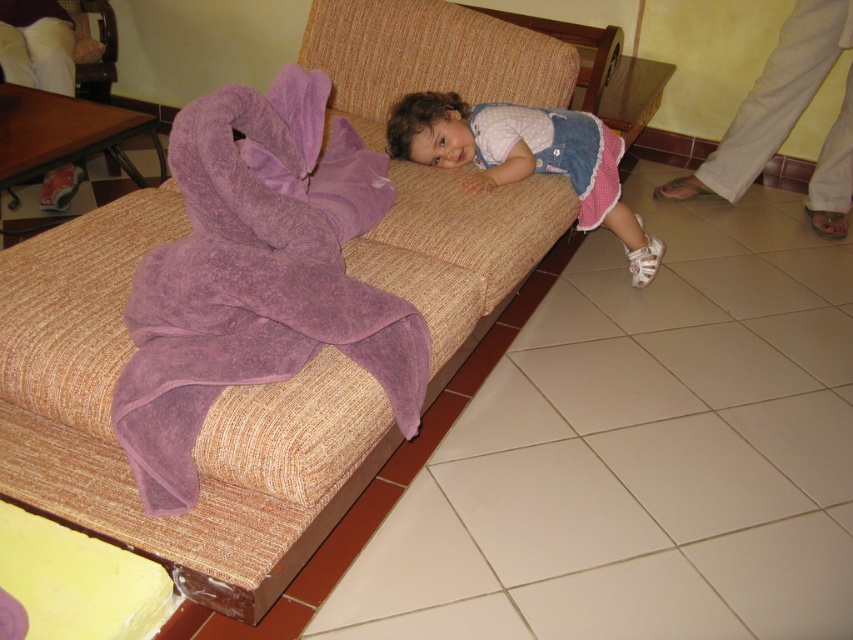
You are a parent trying to place a small nightlight on the floor near the beige textured couch at center and the matte pink dress at center. Which object should you place it closer to if you want the light to reach the taller object more effectively?

The beige textured couch at center is taller than the matte pink dress at center. To ensure the nightlight illuminates the taller object more effectively, place it closer to the beige textured couch at center.

You are a parent trying to reach the purple terry cloth towel at left to dry your child after a bath. Your child is currently lying on the matte pink dress at center. Can you grab the towel without moving the child?

The purple terry cloth towel at left is 26.07 inches away from the matte pink dress at center. Since the distance is sufficient, you can reach the towel without moving the child.

You are standing at the position of the camera and want to move towards the sofa. There are two points marked on the floor near the sofa. The first point is at coordinates point [364,179] and the second point is at point [631,276]. Which point should you step on first if you want to approach the sofa from the front?

Point [364,179] should be stepped on first because it is in front of point [631,276] when approaching the sofa from the front.